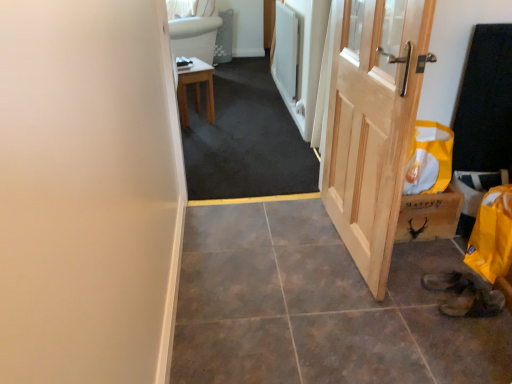
At what (x,y) coordinates should I click in order to perform the action: click on free space on the front side of brown leather shoe at lower right. Please return your answer as a coordinate pair (x, y). Looking at the image, I should click on (479, 336).